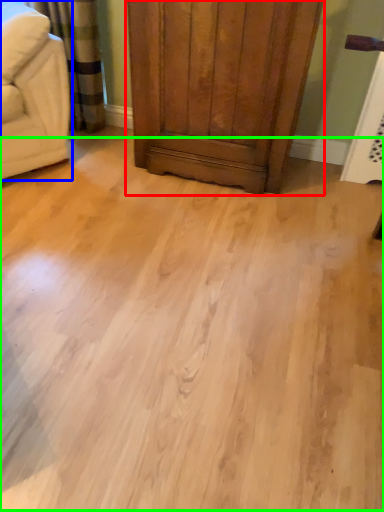
Question: Which is farther away from dresser (highlighted by a red box)? furniture (highlighted by a blue box) or plain (highlighted by a green box)?

Choices:
 (A) furniture
 (B) plain

Answer: (B)